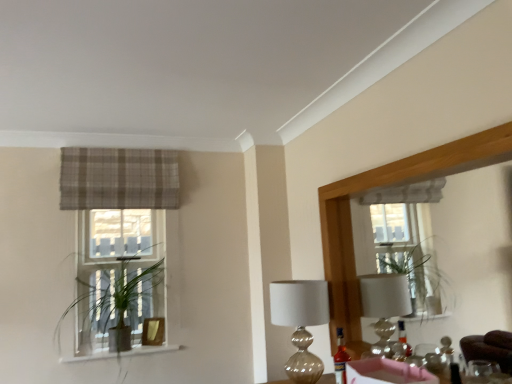
What are the coordinates of `empty space that is ontop of matte wood window sill at lower left (from a real-world perspective)` in the screenshot? It's located at (114, 351).